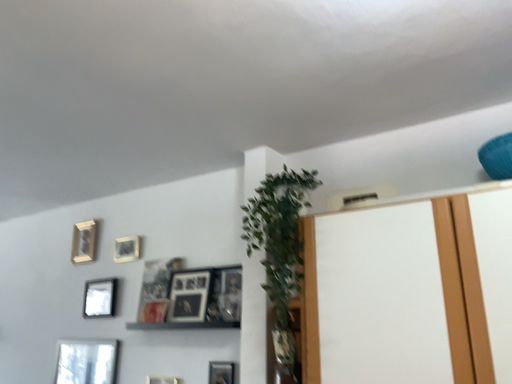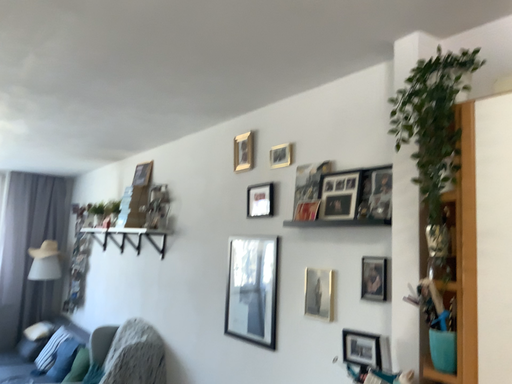
Question: How did the camera likely rotate when shooting the video?

Choices:
 (A) rotated upward
 (B) rotated downward

Answer: (B)